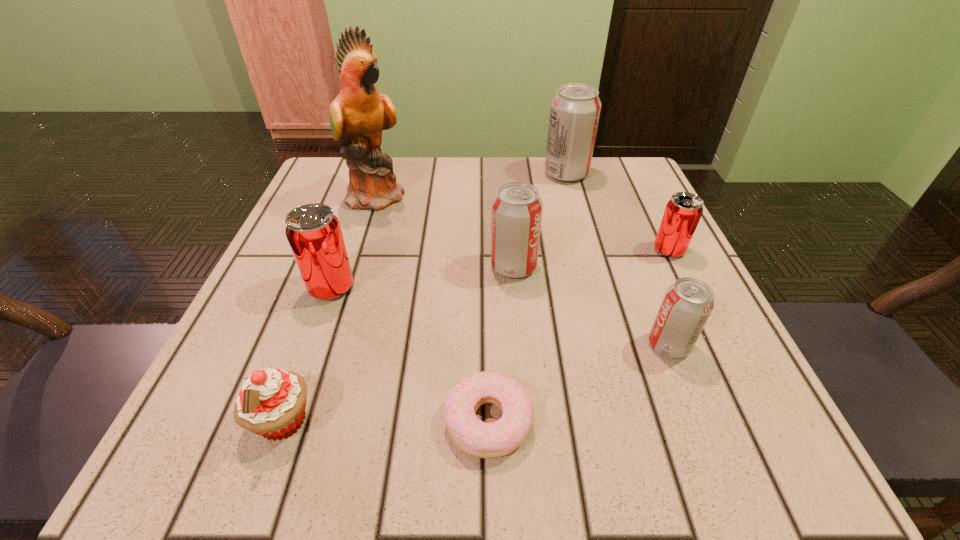
The image size is (960, 540). Identify the location of parrot. (358, 115).

At what (x,y) coordinates should I click in order to perform the action: click on the tallest object. Please return your answer as a coordinate pair (x, y). This screenshot has height=540, width=960. Looking at the image, I should click on (358, 115).

Image resolution: width=960 pixels, height=540 pixels. What are the coordinates of `the farthest soda can` in the screenshot? It's located at (575, 109).

Identify the location of the biggest gray soda can. This screenshot has height=540, width=960. (575, 109).

The height and width of the screenshot is (540, 960). What are the coordinates of `the second smallest gray soda can` in the screenshot? It's located at tap(516, 210).

Identify the location of the second nearest gray soda can. This screenshot has width=960, height=540. (516, 210).

Locate an element on the screen. This screenshot has width=960, height=540. the leftmost soda can is located at coordinates (314, 233).

At what (x,y) coordinates should I click in order to perform the action: click on the bigger red soda can. Please return your answer as a coordinate pair (x, y). This screenshot has width=960, height=540. Looking at the image, I should click on (314, 233).

I want to click on the smaller red soda can, so click(683, 211).

I want to click on the rightmost soda can, so click(683, 211).